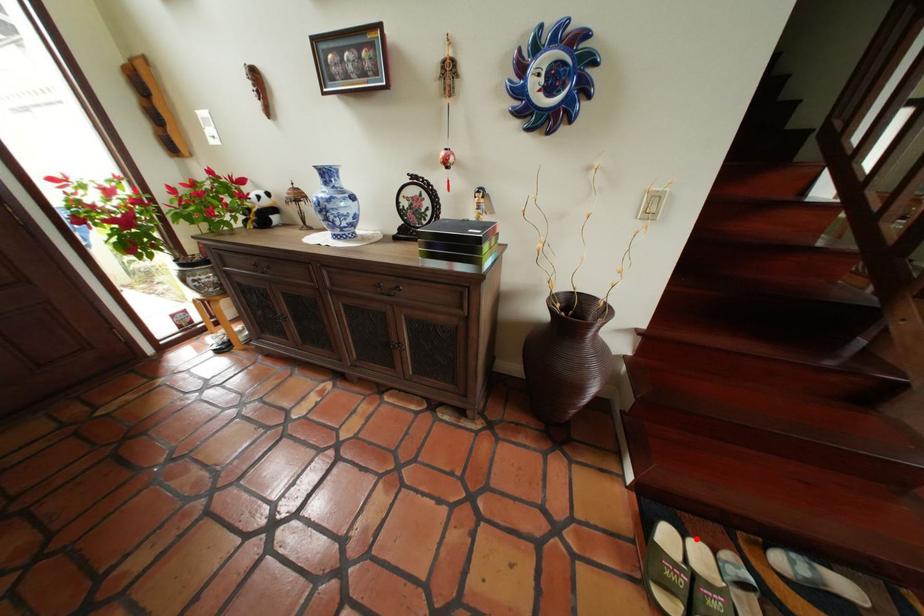
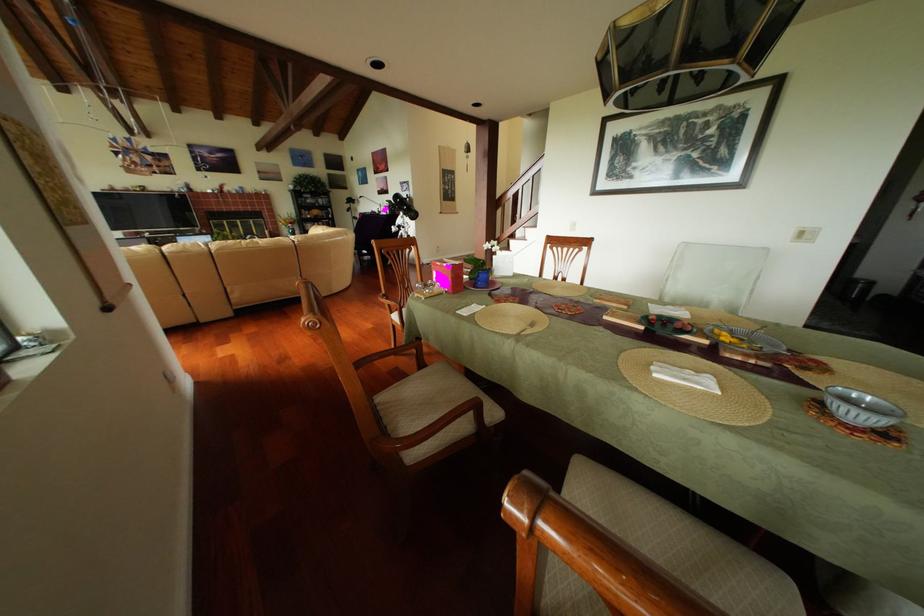
Question: I am providing you with two images of the same scene from different viewpoints. A red point is marked on the first image. At the location where the point appears in image 1, is it still visible in image 2?

Choices:
 (A) Yes
 (B) No

Answer: (B)